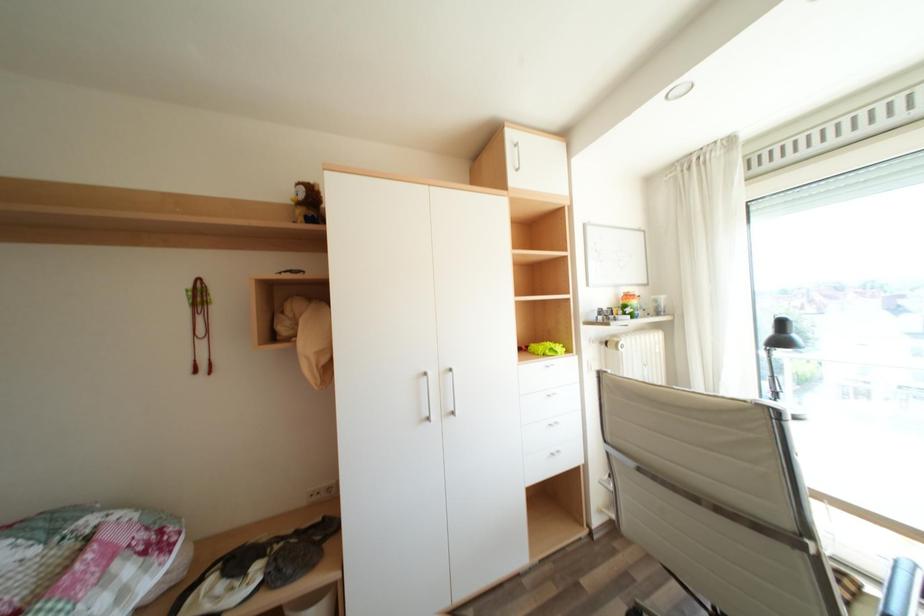
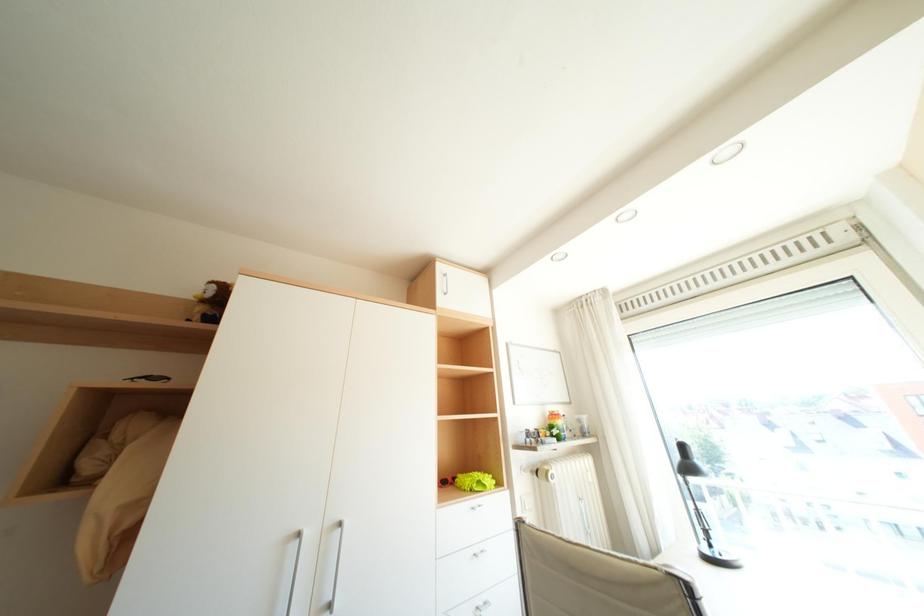
Question: The first image is from the beginning of the video and the second image is from the end. How did the camera likely rotate when shooting the video?

Choices:
 (A) Left
 (B) Right
 (C) Up
 (D) Down

Answer: (C)